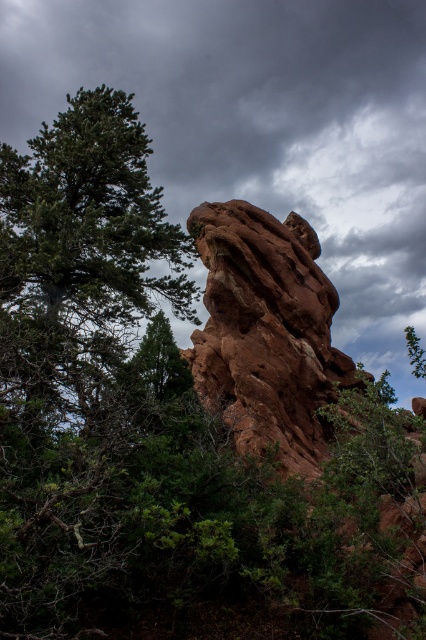
You are standing in a forest facing the large, reddishbrown rock formation. You notice the dark gray cloudy sky at upper center. Based on its position, can you determine if the sky is directly above the rock formation or shifted to one side?

The dark gray cloudy sky at upper center is located at point (261, 125), which indicates it is shifted to the left side relative to the rock formation, so it is not directly above.

You are standing in a forest and looking at the dark gray cloudy sky at upper center. If you want to take a photo of it, will you need to zoom in your camera?

The dark gray cloudy sky at upper center is 17.45 meters away from camera. Since it is relatively far away, you will need to zoom in your camera to capture it clearly.

You are planning to take a photo of the rustic stone rock at center. However, you notice the dark gray cloudy sky at upper center might block the view. Based on their sizes, which one would you need to adjust your camera angle to avoid?

The dark gray cloudy sky at upper center is larger in size compared to the rustic stone rock at center, so you would need to adjust your camera angle to avoid the dark gray cloudy sky at upper center blocking the view.